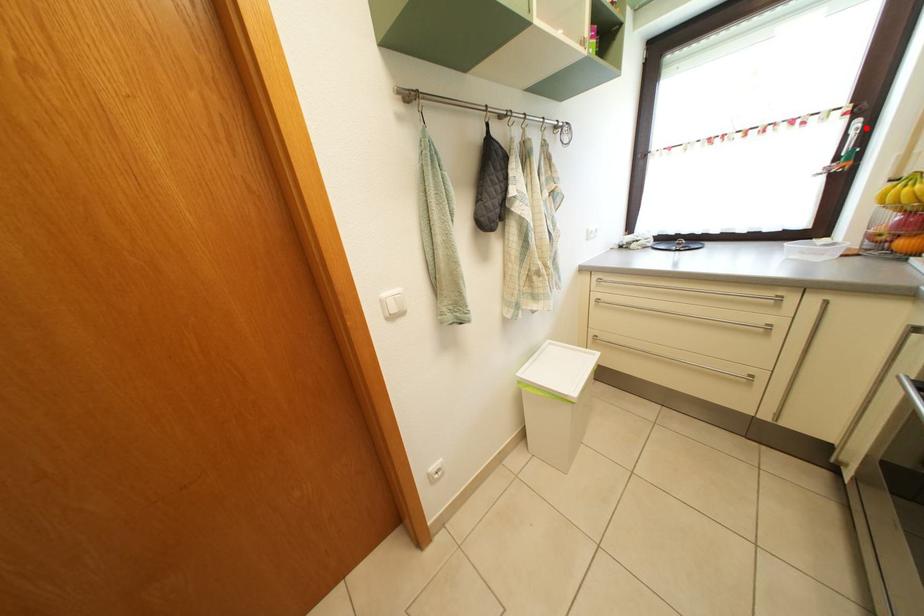
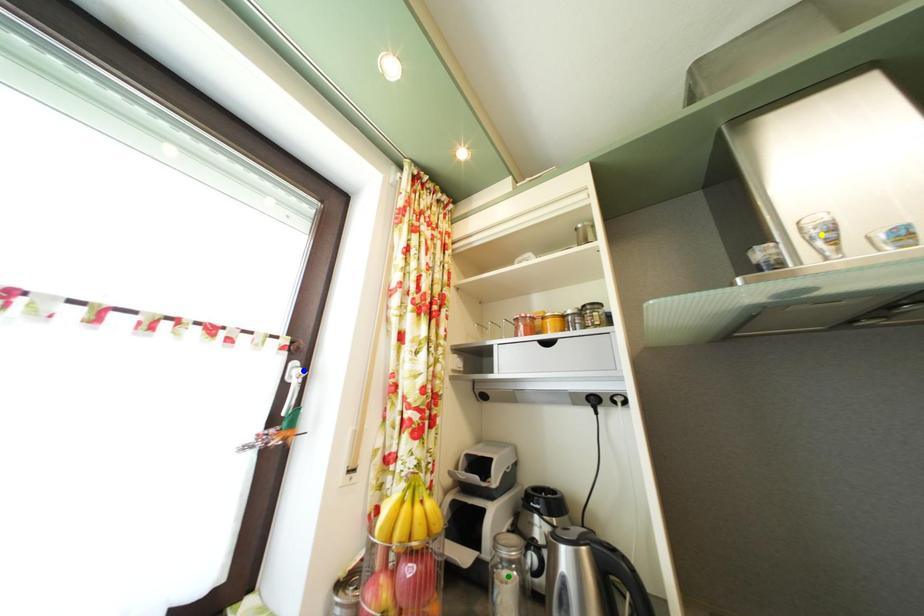
Question: I am providing you with two images of the same scene from different viewpoints. A red point is marked on the first image. You are given multiple points on the second image. Can you choose the point in image 2 that corresponds to the point in image 1?

Choices:
 (A) green point
 (B) blue point
 (C) yellow point

Answer: (B)